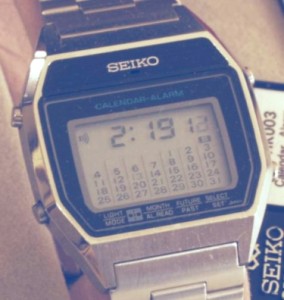
Identify the location of alarm. (79, 136).